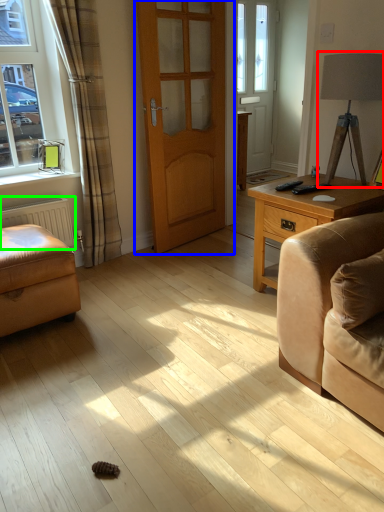
Question: Considering the real-world distances, which object is closest to table lamp (highlighted by a red box)? door (highlighted by a blue box) or radiator (highlighted by a green box).

Choices:
 (A) door
 (B) radiator

Answer: (A)